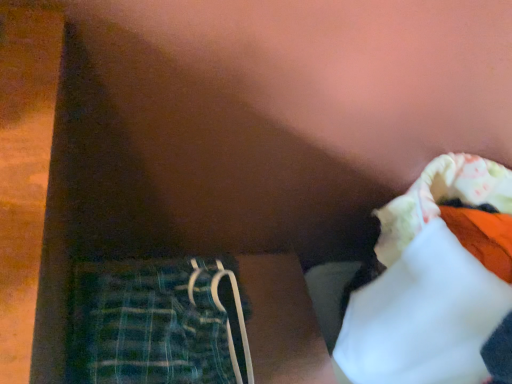
Question: Considering the relative sizes of white fabric at upper right and green plaid fabric at lower left in the image provided, is white fabric at upper right thinner than green plaid fabric at lower left?

Choices:
 (A) yes
 (B) no

Answer: (B)

Question: Is white fabric at upper right taller than green plaid fabric at lower left?

Choices:
 (A) no
 (B) yes

Answer: (B)

Question: Is white fabric at upper right facing away from green plaid fabric at lower left?

Choices:
 (A) no
 (B) yes

Answer: (A)

Question: Is white fabric at upper right next to green plaid fabric at lower left?

Choices:
 (A) yes
 (B) no

Answer: (B)

Question: Considering the relative positions of white fabric at upper right and green plaid fabric at lower left in the image provided, is white fabric at upper right behind green plaid fabric at lower left?

Choices:
 (A) no
 (B) yes

Answer: (A)

Question: From a real-world perspective, is white fabric at upper right on green plaid fabric at lower left?

Choices:
 (A) yes
 (B) no

Answer: (A)

Question: From a real-world perspective, does green plaid fabric at lower left sit lower than white fabric at upper right?

Choices:
 (A) no
 (B) yes

Answer: (B)

Question: Considering the relative sizes of green plaid fabric at lower left and white fabric at upper right in the image provided, is green plaid fabric at lower left wider than white fabric at upper right?

Choices:
 (A) yes
 (B) no

Answer: (B)

Question: Is green plaid fabric at lower left positioned far away from white fabric at upper right?

Choices:
 (A) yes
 (B) no

Answer: (B)

Question: Is the depth of green plaid fabric at lower left greater than that of white fabric at upper right?

Choices:
 (A) no
 (B) yes

Answer: (B)

Question: Is green plaid fabric at lower left closer to camera compared to white fabric at upper right?

Choices:
 (A) no
 (B) yes

Answer: (A)

Question: Is green plaid fabric at lower left to the right of white fabric at upper right from the viewer's perspective?

Choices:
 (A) no
 (B) yes

Answer: (A)

Question: Is green plaid fabric at lower left wider or thinner than white fabric at upper right?

Choices:
 (A) thin
 (B) wide

Answer: (A)